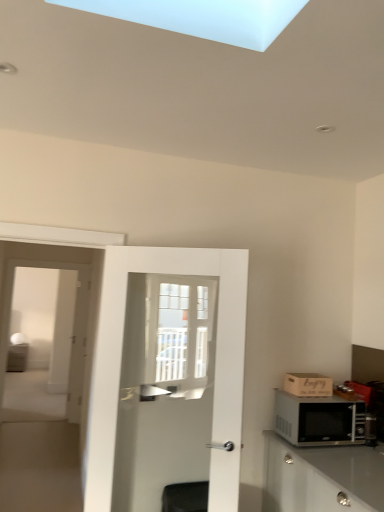
Question: Considering the relative sizes of wooden crate at right and white glass screen door at left in the image provided, is wooden crate at right taller than white glass screen door at left?

Choices:
 (A) no
 (B) yes

Answer: (A)

Question: Does wooden crate at right have a lesser height compared to white glass screen door at left?

Choices:
 (A) yes
 (B) no

Answer: (A)

Question: Is wooden crate at right outside of white glass screen door at left?

Choices:
 (A) no
 (B) yes

Answer: (B)

Question: Is wooden crate at right placed right next to white glass screen door at left?

Choices:
 (A) no
 (B) yes

Answer: (A)

Question: Is wooden crate at right not close to white glass screen door at left?

Choices:
 (A) yes
 (B) no

Answer: (A)

Question: Choose the correct answer: Is black metallic microwave at right inside matte white cabinet at left or outside it?

Choices:
 (A) inside
 (B) outside

Answer: (B)

Question: Considering the positions of black metallic microwave at right and matte white cabinet at left in the image, is black metallic microwave at right taller or shorter than matte white cabinet at left?

Choices:
 (A) tall
 (B) short

Answer: (B)

Question: From a real-world perspective, is black metallic microwave at right above or below matte white cabinet at left?

Choices:
 (A) above
 (B) below

Answer: (A)

Question: In the image, is black metallic microwave at right on the left side or the right side of matte white cabinet at left?

Choices:
 (A) left
 (B) right

Answer: (B)

Question: Considering the positions of point (215, 349) and point (306, 440), is point (215, 349) closer or farther from the camera than point (306, 440)?

Choices:
 (A) closer
 (B) farther

Answer: (A)

Question: Is white glossy door at center taller or shorter than black metallic microwave at right?

Choices:
 (A) tall
 (B) short

Answer: (A)

Question: Is white glossy door at center to the left or to the right of black metallic microwave at right in the image?

Choices:
 (A) left
 (B) right

Answer: (A)

Question: Based on their sizes in the image, would you say white glossy door at center is bigger or smaller than black metallic microwave at right?

Choices:
 (A) big
 (B) small

Answer: (A)

Question: Considering the positions of point (23, 368) and point (349, 407), is point (23, 368) closer or farther from the camera than point (349, 407)?

Choices:
 (A) farther
 (B) closer

Answer: (A)

Question: From the image's perspective, is matte white cabinet at left above or below black metallic microwave at right?

Choices:
 (A) below
 (B) above

Answer: (A)